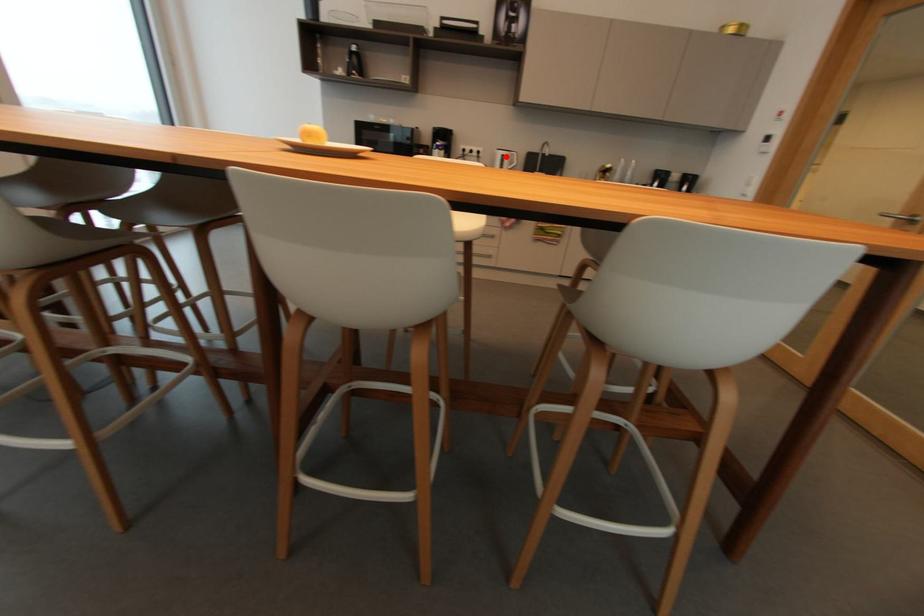
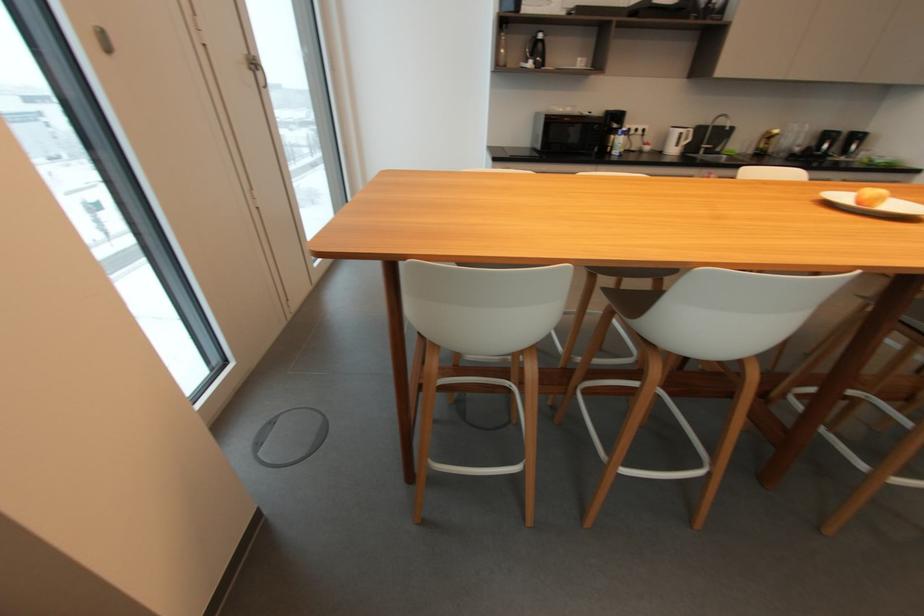
In the second image, find the point that corresponds to the highlighted location in the first image.

(685, 134)